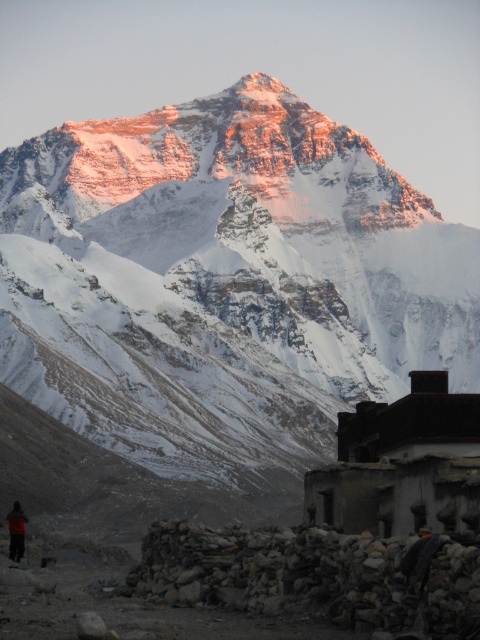
Does snowy rock mountain at center appear on the right side of rustic stone hut at lower right?

In fact, snowy rock mountain at center is to the left of rustic stone hut at lower right.

Is snowy rock mountain at center thinner than rustic stone hut at lower right?

In fact, snowy rock mountain at center might be wider than rustic stone hut at lower right.

Measure the distance between snowy rock mountain at center and camera.

snowy rock mountain at center and camera are 458.39 feet apart.

Where is `snowy rock mountain at center`? snowy rock mountain at center is located at coordinates (224, 288).

Which of these two, snowy rock mountain at center or orange fabric jacket at lower left, stands taller?

snowy rock mountain at center is taller.

Is snowy rock mountain at center behind orange fabric jacket at lower left?

Yes, it is behind orange fabric jacket at lower left.

Is point (187, 221) more distant than point (17, 552)?

Yes.

Where is `snowy rock mountain at center`? The width and height of the screenshot is (480, 640). snowy rock mountain at center is located at coordinates (224, 288).

Who is more forward, [399,404] or [12,509]?

Positioned in front is point [399,404].

From the picture: Does rustic stone hut at lower right have a greater height compared to orange fabric jacket at lower left?

Indeed, rustic stone hut at lower right has a greater height compared to orange fabric jacket at lower left.

Where is `rustic stone hut at lower right`? The width and height of the screenshot is (480, 640). rustic stone hut at lower right is located at coordinates (400, 461).